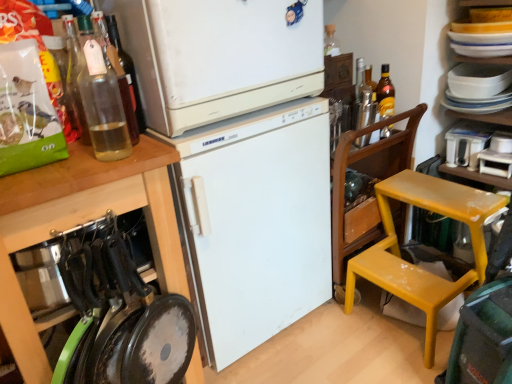
Question: From a real-world perspective, is white plastic container at upper right, marked as the second appliance in a top-to-bottom arrangement, below clear glass bottle at upper left, which is the 4th bottle in back-to-front order?

Choices:
 (A) no
 (B) yes

Answer: (B)

Question: Is white plastic container at upper right, marked as the second appliance in a top-to-bottom arrangement, turned away from clear glass bottle at upper left, placed as the fourth bottle when sorted from right to left?

Choices:
 (A) no
 (B) yes

Answer: (A)

Question: From the image's perspective, is white plastic container at upper right, marked as the second appliance in a top-to-bottom arrangement, over clear glass bottle at upper left, marked as the 1th bottle in a front-to-back arrangement?

Choices:
 (A) no
 (B) yes

Answer: (A)

Question: Does white plastic container at upper right, marked as the second appliance in a top-to-bottom arrangement, have a smaller size compared to clear glass bottle at upper left, placed as the fourth bottle when sorted from right to left?

Choices:
 (A) no
 (B) yes

Answer: (A)

Question: Can you confirm if white plastic container at upper right, marked as the second appliance in a top-to-bottom arrangement, is thinner than clear glass bottle at upper left, marked as the 1th bottle in a front-to-back arrangement?

Choices:
 (A) no
 (B) yes

Answer: (A)

Question: Could you tell me if white plastic container at upper right, the first appliance from the bottom, is turned towards clear glass bottle at upper left, marked as the 1th bottle in a front-to-back arrangement?

Choices:
 (A) no
 (B) yes

Answer: (B)

Question: Is white plastic container at upper right, marked as the second appliance in a top-to-bottom arrangement, to the left of translucent glass bottle at upper right, acting as the fourth bottle starting from the left, from the viewer's perspective?

Choices:
 (A) yes
 (B) no

Answer: (B)

Question: From a real-world perspective, is white plastic container at upper right, the first appliance from the bottom, positioned under translucent glass bottle at upper right, acting as the fourth bottle starting from the left, based on gravity?

Choices:
 (A) yes
 (B) no

Answer: (A)

Question: Does white plastic container at upper right, the first appliance from the bottom, have a larger size compared to translucent glass bottle at upper right, positioned as the fourth bottle in front-to-back order?

Choices:
 (A) no
 (B) yes

Answer: (B)

Question: Considering the relative sizes of white plastic container at upper right, marked as the second appliance in a top-to-bottom arrangement, and translucent glass bottle at upper right, positioned as the fourth bottle in front-to-back order, in the image provided, is white plastic container at upper right, marked as the second appliance in a top-to-bottom arrangement, thinner than translucent glass bottle at upper right, positioned as the fourth bottle in front-to-back order,?

Choices:
 (A) yes
 (B) no

Answer: (B)

Question: Could you tell me if white plastic container at upper right, marked as the second appliance in a top-to-bottom arrangement, is facing translucent glass bottle at upper right, acting as the fourth bottle starting from the left?

Choices:
 (A) yes
 (B) no

Answer: (B)

Question: Is white plastic container at upper right, the first appliance from the bottom, placed right next to translucent glass bottle at upper right, the 1th bottle when ordered from back to front?

Choices:
 (A) yes
 (B) no

Answer: (B)

Question: Is white matte refrigerator at upper center, arranged as the 1th refrigerator when viewed from the top, oriented towards white matte cabinet at left?

Choices:
 (A) yes
 (B) no

Answer: (B)